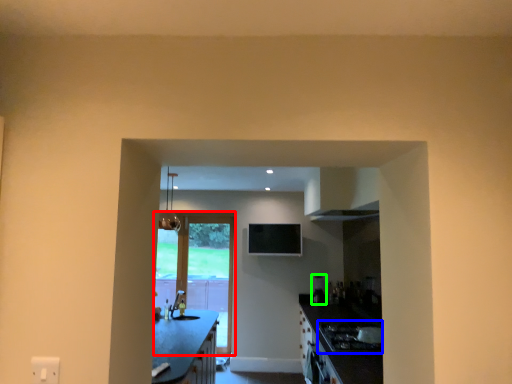
Question: Based on their relative distances, which object is nearer to door (highlighted by a red box)? Choose from gas stove (highlighted by a blue box) and appliance (highlighted by a green box).

Choices:
 (A) gas stove
 (B) appliance

Answer: (B)